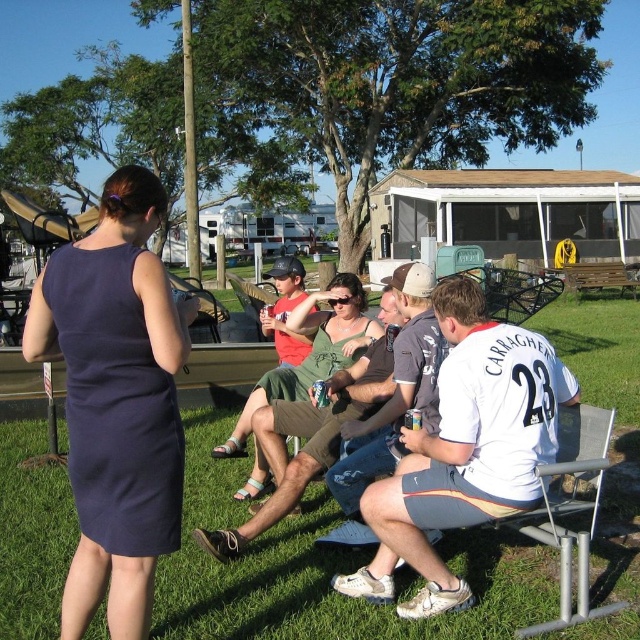
Is dark gray cotton t-shirt at center to the left of green fabric dress at center from the viewer's perspective?

Incorrect, dark gray cotton t-shirt at center is not on the left side of green fabric dress at center.

Between dark gray cotton t-shirt at center and green fabric dress at center, which one is positioned higher?

Positioned higher is dark gray cotton t-shirt at center.

Where is `dark gray cotton t-shirt at center`? dark gray cotton t-shirt at center is located at coordinates (394, 392).

Who is more distant from viewer, (188, 433) or (45, 275)?

Point (188, 433)

Between green grass at center and navy blue fabric dress at left, which one has less height?

With less height is navy blue fabric dress at left.

Where is `green grass at center`? This screenshot has height=640, width=640. green grass at center is located at coordinates 323,570.

Who is positioned more to the right, navy blue fabric dress at left or green fabric dress at center?

From the viewer's perspective, green fabric dress at center appears more on the right side.

Between navy blue fabric dress at left and green fabric dress at center, which one is positioned lower?

green fabric dress at center is lower down.

Who is more distant from viewer, (120,387) or (227,438)?

Point (227,438)

Where is `navy blue fabric dress at left`? navy blue fabric dress at left is located at coordinates (115, 404).